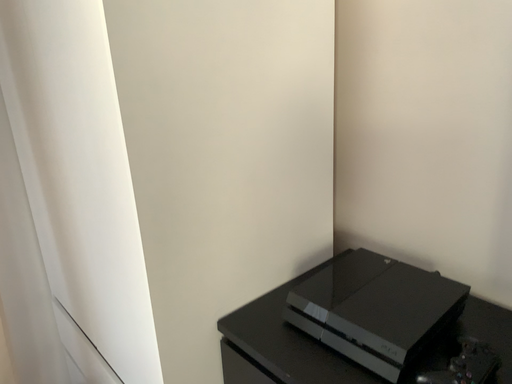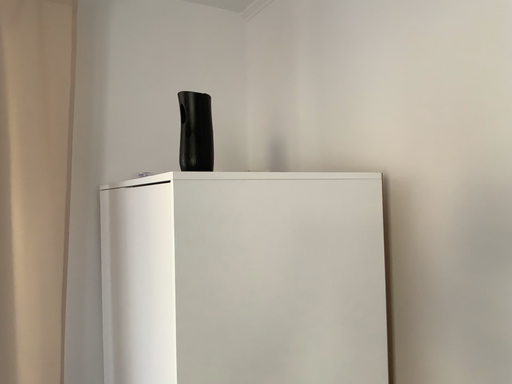
Question: How did the camera likely rotate when shooting the video?

Choices:
 (A) rotated downward
 (B) rotated upward

Answer: (B)